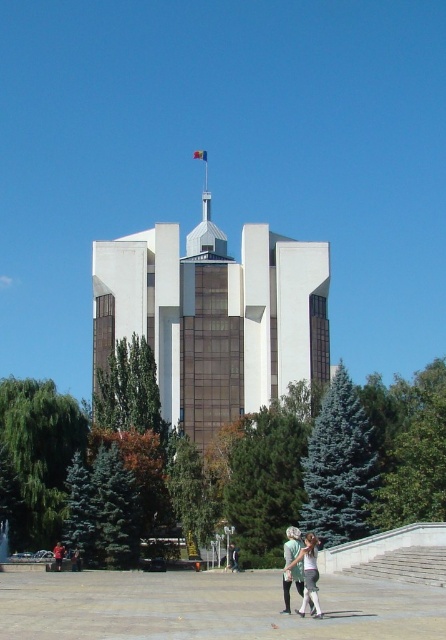
You are standing in front of the white glass building at center and the white cotton shirt at lower center. Which object is taller?

The white glass building at center is taller than the white cotton shirt at lower center.

You are standing at the base of the flagpole on the roof of the white glass building at center. You want to walk down to the white cotton shirt at lower center. How many steps would you need to take if each step covers approximately 2.5 feet?

The white glass building at center and white cotton shirt at lower center are 170.74 feet apart. Dividing the distance by the step length of 2.5 feet gives approximately 68.296 steps. Since you can only take whole steps, you would need to take 69 steps to reach the white cotton shirt at lower center.